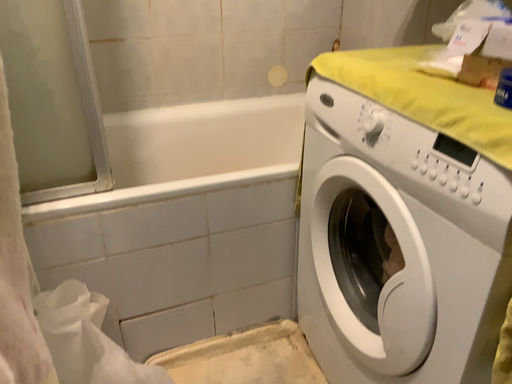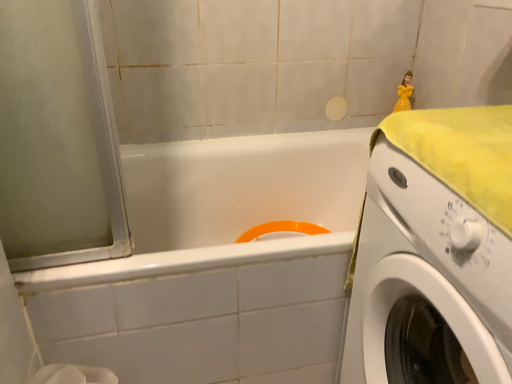
Question: How did the camera likely rotate when shooting the video?

Choices:
 (A) rotated left
 (B) rotated right

Answer: (A)